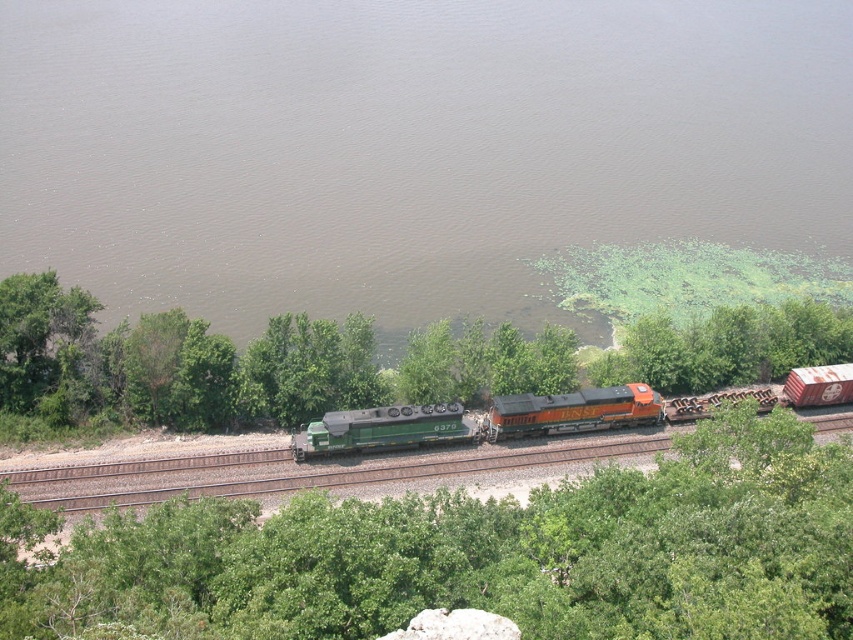
Question: Can you confirm if orange glossy locomotive at center is positioned above green matte train car at center?

Choices:
 (A) no
 (B) yes

Answer: (B)

Question: Among these points, which one is nearest to the camera?

Choices:
 (A) (608, 428)
 (B) (354, 410)
 (C) (277, 374)
 (D) (120, 540)

Answer: (D)

Question: Which object is farther from the camera taking this photo?

Choices:
 (A) brown murky water at upper center
 (B) green matte train car at center
 (C) green leafy trees at lower center

Answer: (A)

Question: Is green leafy tree at center wider than green leafy trees at lower center?

Choices:
 (A) yes
 (B) no

Answer: (B)

Question: Which point is farther to the camera?

Choices:
 (A) (718, 131)
 (B) (90, 378)
 (C) (364, 412)

Answer: (A)

Question: Does green leafy trees at lower center appear under green matte train at center?

Choices:
 (A) no
 (B) yes

Answer: (A)